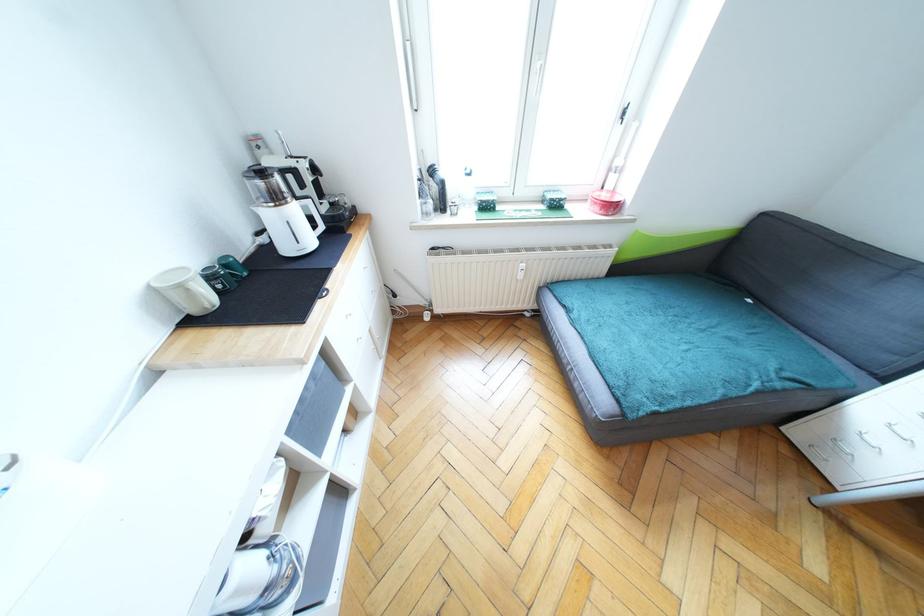
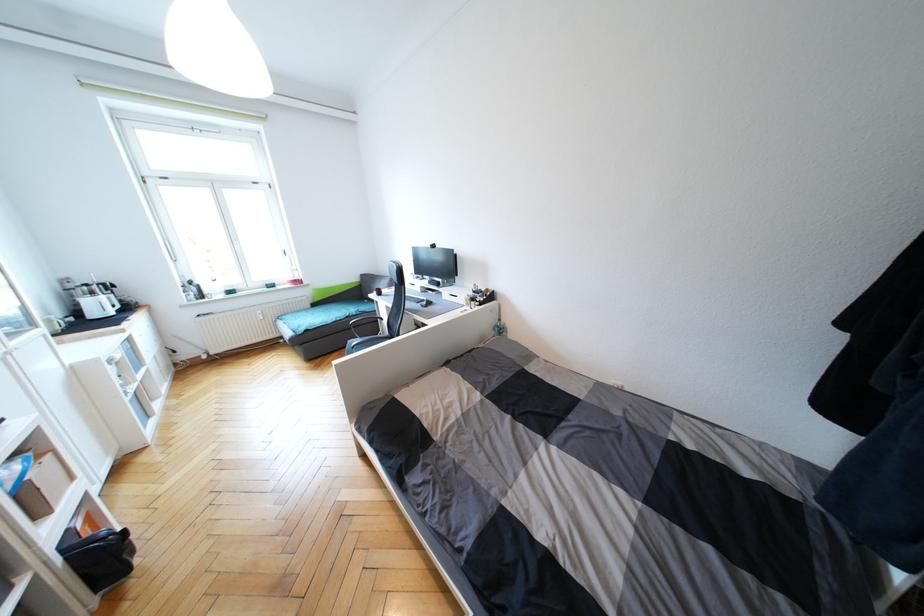
Where in the second image is the point corresponding to [280,198] from the first image?

(95, 294)